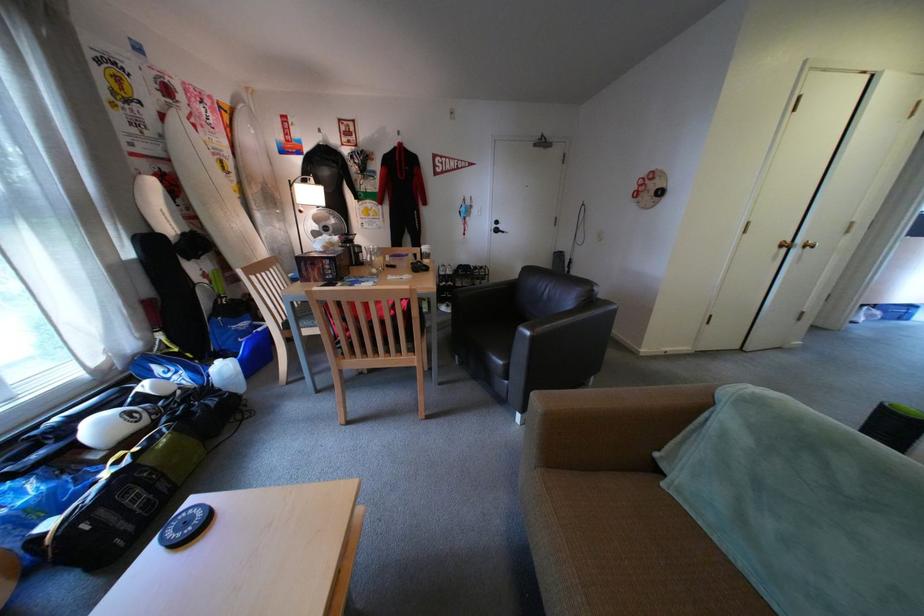
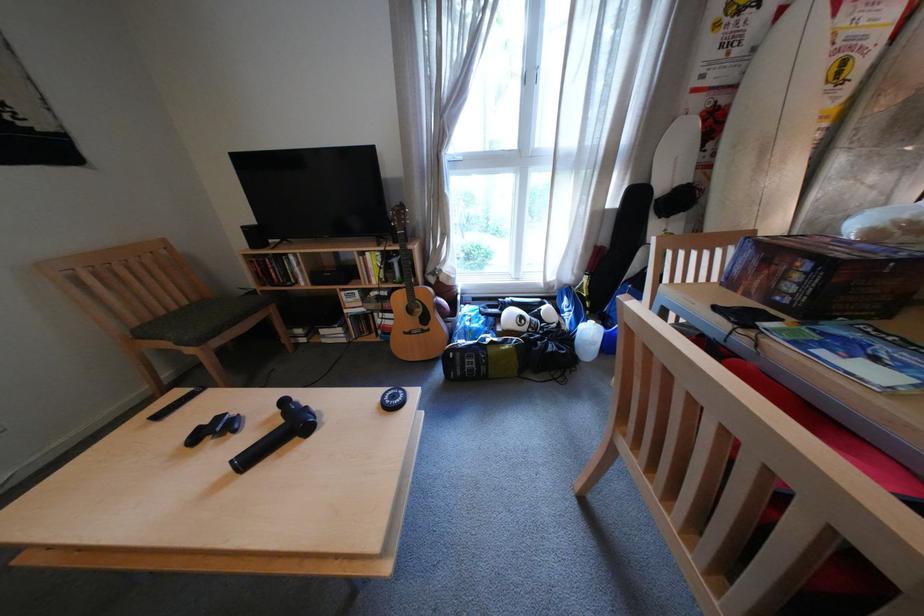
Based on the continuous images, in which direction is the camera rotating?

The camera's rotation is toward left-down.